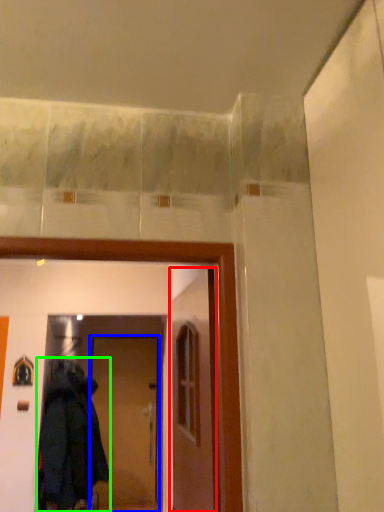
Question: Which is farther away from door (highlighted by a red box)? door (highlighted by a blue box) or coat (highlighted by a green box)?

Choices:
 (A) door
 (B) coat

Answer: (A)